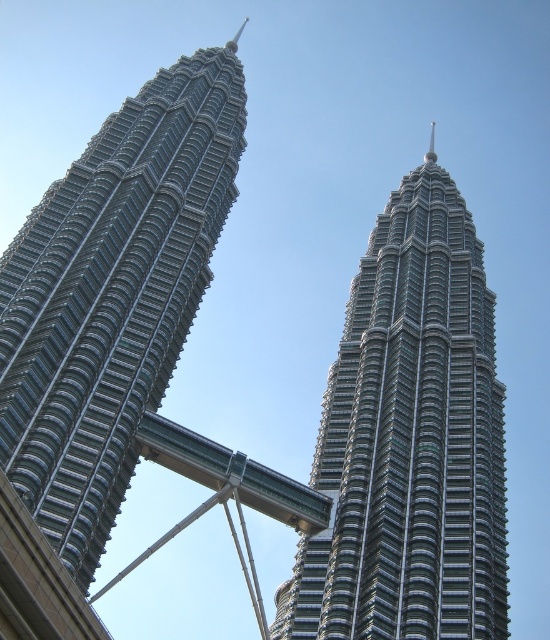
You are a photographer planning to take a photo of the Petronas Twin Towers. You notice two skyscrapers at the center of your viewfinder labeled as metallic glass skyscraper at center and shiny metallic skyscraper at center. If you want to focus on the one closer to you, which one should you choose?

The metallic glass skyscraper at center is closer to you since the shiny metallic skyscraper at center is positioned behind it.

You are a photographer planning to capture the Petronas Twin Towers. You have a camera with a 30cm wide lens. If you want to frame both the metallic glass skyscraper at center and the shiny metallic skyscraper at center in the same shot, will the lens width be sufficient?

The metallic glass skyscraper at center is wider than the shiny metallic skyscraper at center. However, since both are positioned at the center, their combined width may exceed the 30cm lens width. Without exact measurements of their combined width, it is uncertain if the lens will be sufficient.

Looking at this image, you are a drone operator who needs to fly a drone between the two skyscrapers. The drone has a maximum flight distance of 20 meters between obstacles. Can you safely fly the drone between the metallic glass skyscraper at center and the shiny metallic skyscraper at center?

The distance between the metallic glass skyscraper at center and the shiny metallic skyscraper at center is 19.65 meters, which is within the drone operator maximum flight distance of 20 meters. Therefore, the drone can safely fly between them.